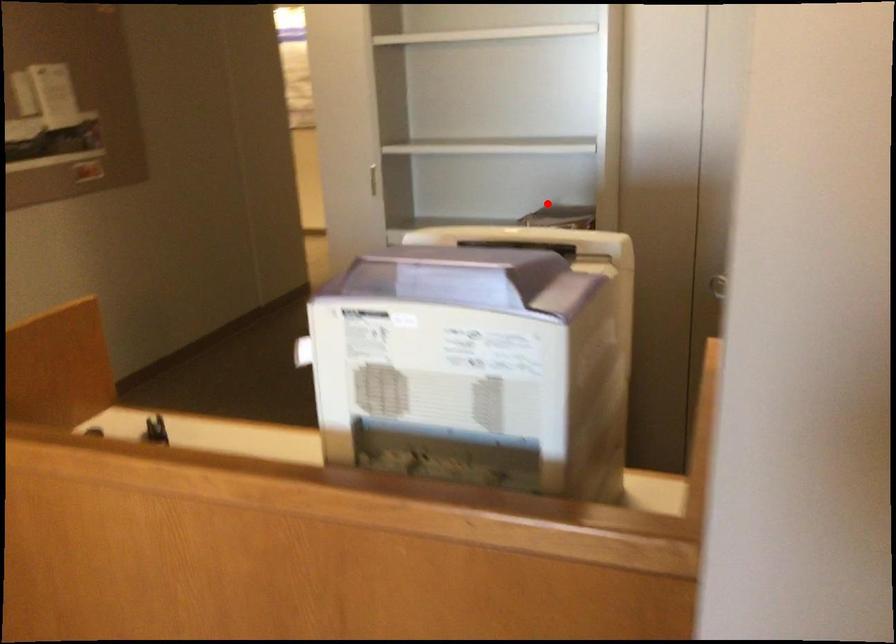
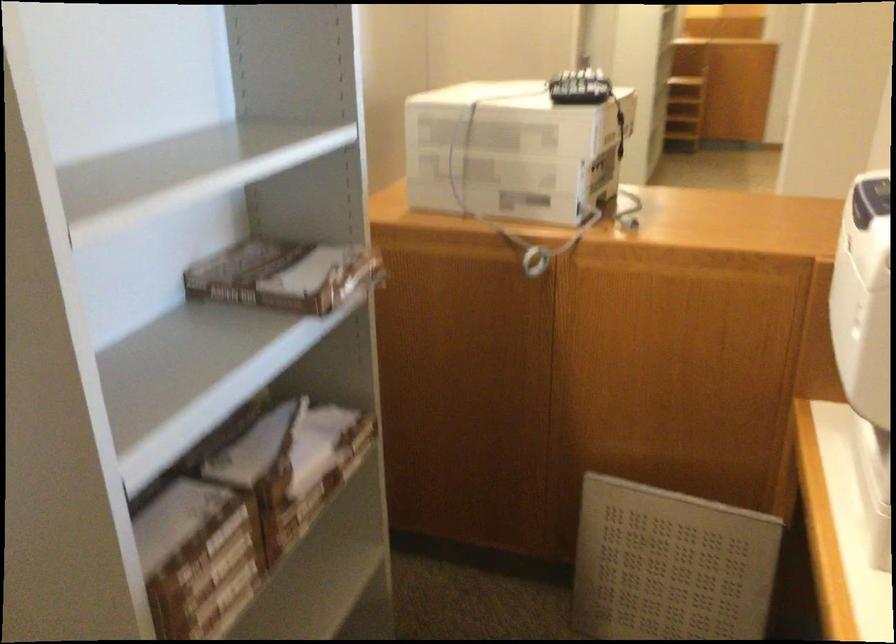
Question: I am providing you with two images of the same scene from different viewpoints. In image1, a red point is highlighted. Considering the same 3D point in image2, which of the following is correct?

Choices:
 (A) It is closer
 (B) It is farther

Answer: (A)